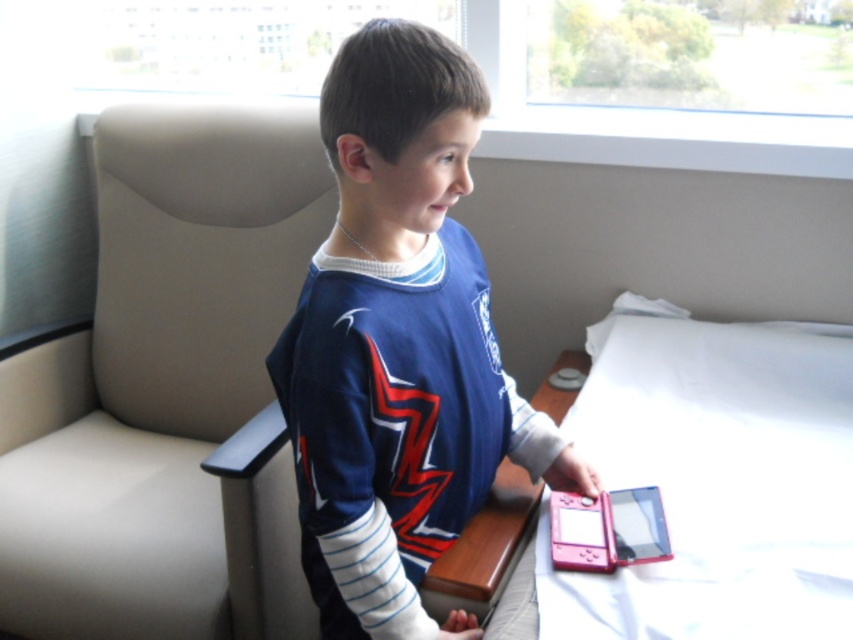
Question: Is pink plastic bed at lower right thinner than pink plastic game console at lower right?

Choices:
 (A) yes
 (B) no

Answer: (B)

Question: Does blue jersey at center have a larger size compared to pink plastic bed at lower right?

Choices:
 (A) no
 (B) yes

Answer: (A)

Question: Which of the following is the closest to the observer?

Choices:
 (A) (579, 557)
 (B) (670, 554)

Answer: (B)

Question: Which of the following is the farthest from the observer?

Choices:
 (A) (421, 333)
 (B) (619, 506)
 (C) (550, 529)

Answer: (B)

Question: Observing the image, what is the correct spatial positioning of pink plastic bed at lower right in reference to pink plastic tablet at lower right?

Choices:
 (A) above
 (B) below

Answer: (A)

Question: Which point appears farthest from the camera in this image?

Choices:
 (A) (663, 520)
 (B) (396, 465)
 (C) (561, 509)
 (D) (601, 456)

Answer: (D)